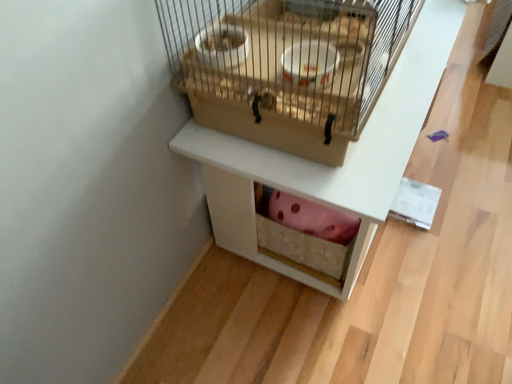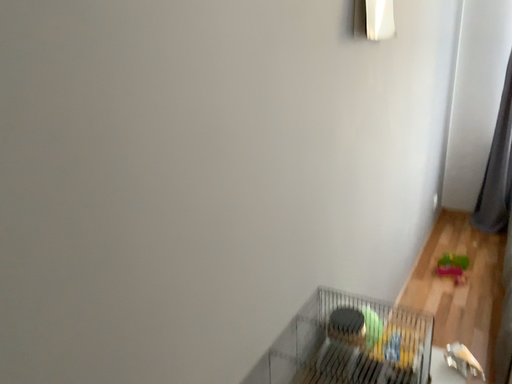
Question: How did the camera likely rotate when shooting the video?

Choices:
 (A) rotated upward
 (B) rotated downward

Answer: (A)